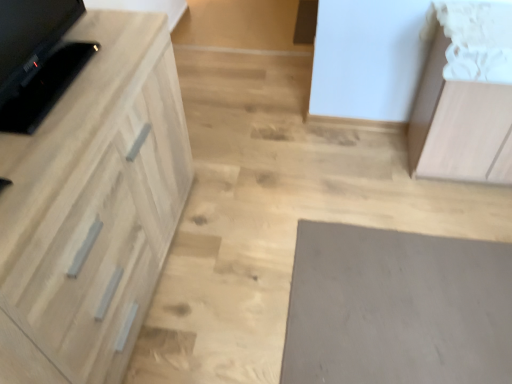
At what (x,y) coordinates should I click in order to perform the action: click on vacant space to the right of light wood cabinet at left, acting as the 2th cabinetry starting from the right. Please return your answer as a coordinate pair (x, y). Looking at the image, I should click on (251, 240).